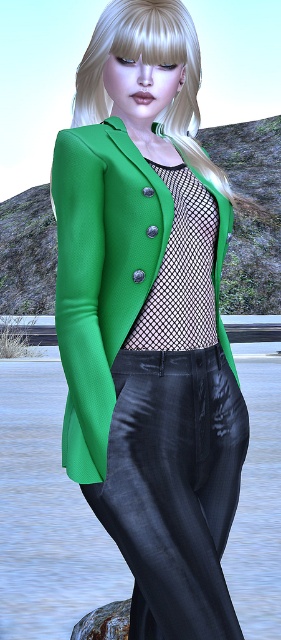
You are a photographer setting up a shoot in this scene. You need to position a spotlight to the left of both the shiny black pants at center and the green textured coat at center. Is this possible given their positions?

The shiny black pants at center is to the right of green textured coat at center. Therefore, the spotlight can be placed to the left of both objects since the green textured coat at center is further left than the shiny black pants at center.

You are a photographer capturing the scene described. You notice a point at coordinates (173, 486) on your camera screen. What object is located at this point?

The point at coordinates (173, 486) marks the shiny black pants at center.

You are a photographer setting up for a shoot. You need to ensure that both the shiny black pants at center and the green textured coat at center are visible in the frame. Given their positions, which object should you focus on first to ensure depth of field captures both?

The green textured coat at center is behind the shiny black pants at center, so you should focus on the green textured coat at center first to ensure depth of field captures both objects clearly.